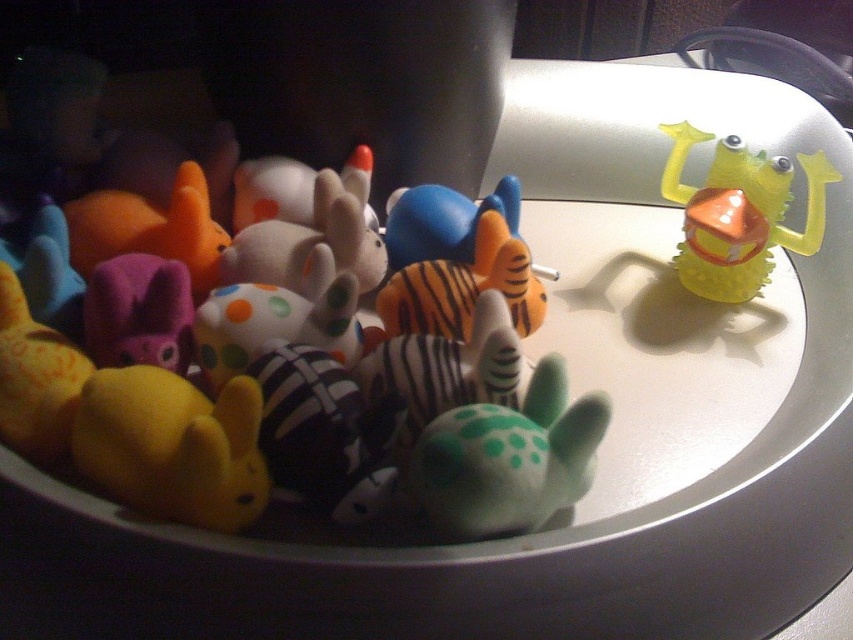
The height and width of the screenshot is (640, 853). What do you see at coordinates (149, 228) in the screenshot? I see `matte purple plush at left` at bounding box center [149, 228].

Can you confirm if matte purple plush at left is positioned below blue matte plush toy at center?

Actually, matte purple plush at left is above blue matte plush toy at center.

The image size is (853, 640). What do you see at coordinates (149, 228) in the screenshot?
I see `matte purple plush at left` at bounding box center [149, 228].

In order to click on matte purple plush at left in this screenshot , I will do `click(149, 228)`.

Which is behind, point (476, 508) or point (751, 268)?

The point (751, 268) is behind.

Locate an element on the screen. The image size is (853, 640). green matte turtle at center is located at coordinates (508, 458).

Does rubber duck at upper right have a lesser width compared to blue matte plush toy at center?

Yes, rubber duck at upper right is thinner than blue matte plush toy at center.

Does rubber duck at upper right have a greater height compared to blue matte plush toy at center?

Indeed, rubber duck at upper right has a greater height compared to blue matte plush toy at center.

Image resolution: width=853 pixels, height=640 pixels. In order to click on rubber duck at upper right in this screenshot , I will do `click(740, 212)`.

Image resolution: width=853 pixels, height=640 pixels. What are the coordinates of `rubber duck at upper right` in the screenshot? It's located at (740, 212).